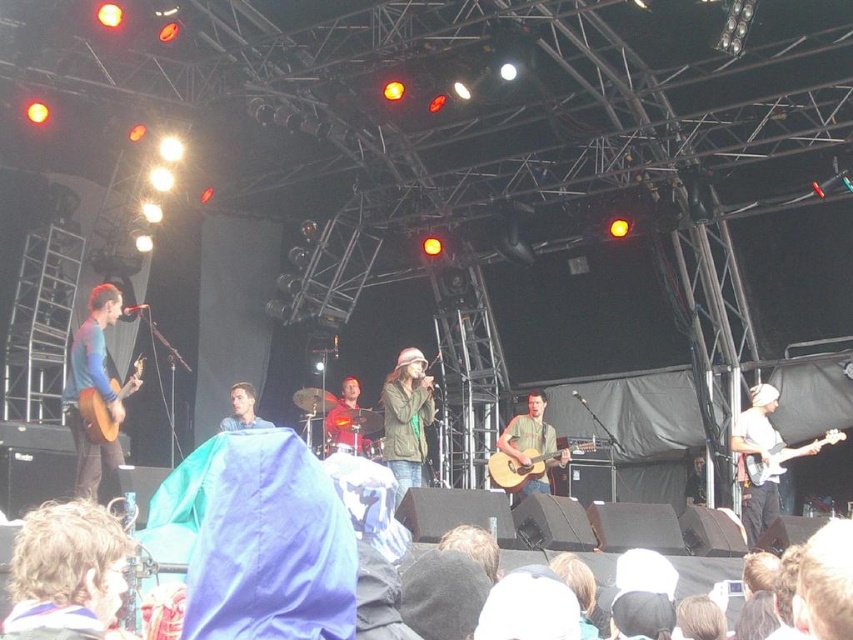
Question: Is matte black guitar at right below green matte jacket at center?

Choices:
 (A) no
 (B) yes

Answer: (B)

Question: Can you confirm if matte black guitar at right is positioned above green matte jacket at center?

Choices:
 (A) no
 (B) yes

Answer: (A)

Question: Estimate the real-world distances between objects in this image. Which object is farther from the matte black guitar at right?

Choices:
 (A) acoustic wood guitar at center
 (B) matte brown guitar at left

Answer: (B)

Question: Estimate the real-world distances between objects in this image. Which object is closer to the acoustic wood guitar at left?

Choices:
 (A) green matte jacket at center
 (B) acoustic wood guitar at center

Answer: (A)

Question: Estimate the real-world distances between objects in this image. Which object is farther from the matte brown guitar at left?

Choices:
 (A) green matte jacket at center
 (B) blue fabric at center

Answer: (A)

Question: From the image, what is the correct spatial relationship of green textured shirt at center in relation to white glossy electric guitar at right?

Choices:
 (A) right
 (B) left

Answer: (B)